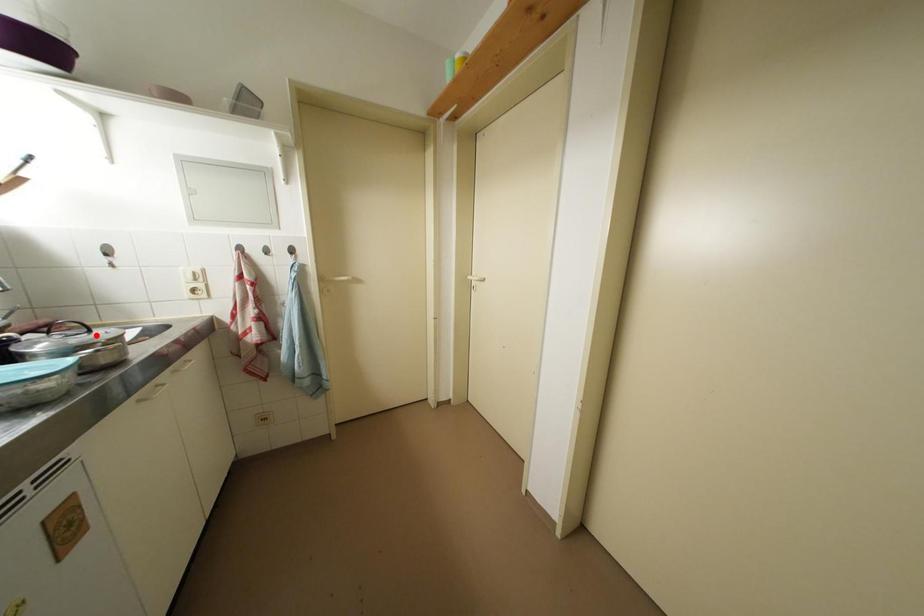
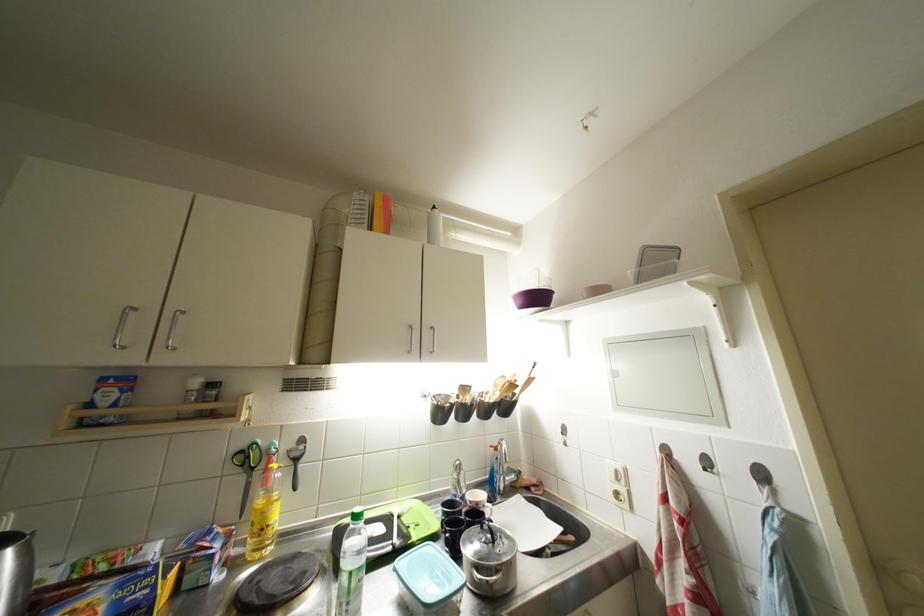
Locate, in the second image, the point that corresponds to the highlighted location in the first image.

(500, 546)